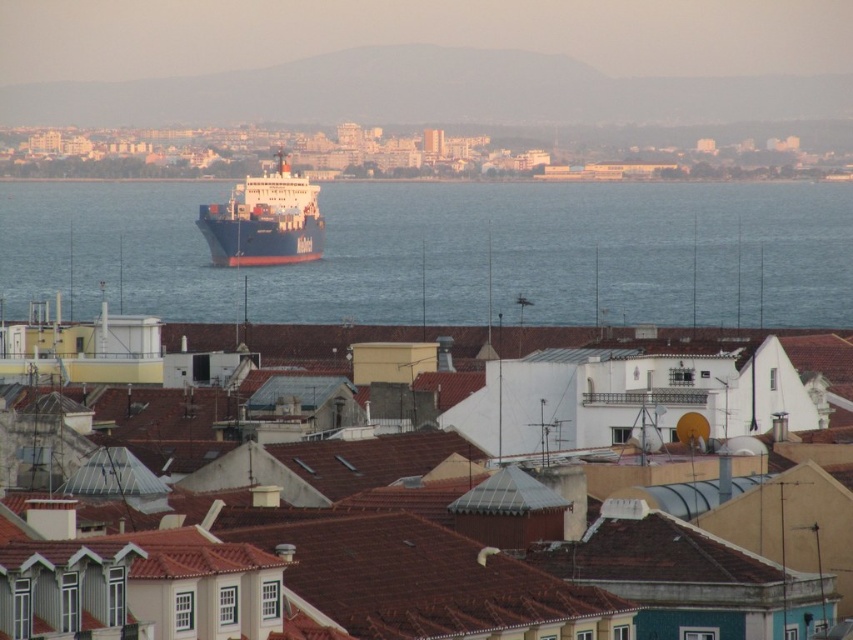
You are standing on a cliff overlooking the coastal city. You see the blue matte water at center and the blue matte cargo ship at center. Which one is positioned to the right of the other?

The blue matte water at center is to the right of the blue matte cargo ship at center.

You are a photographer standing on a cliff overlooking the coastal cityscape. You want to capture a photo where the blue matte cargo ship at center appears larger than the blue matte water at center. Is this possible given their current positions and sizes?

The blue matte water at center is much taller than the blue matte cargo ship at center, so it would be challenging to make the cargo ship appear larger in the photo unless you use a telephoto lens to compress the perspective or move closer to the ship to emphasize its size relative to the water.

You are standing on a cliff overlooking the coastal cityscape. You see the blue matte water at center and the blue matte cargo ship at center. Which one is closer to you?

The blue matte water at center is closer to the viewer than the blue matte cargo ship at center.